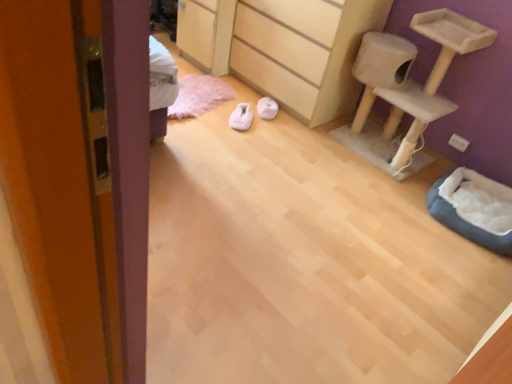
Question: Is white fabric slipper at center, which is the first footwear from right to left, far from white fabric slipper at center, arranged as the first footwear when viewed from the left?

Choices:
 (A) no
 (B) yes

Answer: (A)

Question: Does white fabric slipper at center, which is the second footwear from left to right, have a greater height compared to white fabric slipper at center, arranged as the first footwear when viewed from the left?

Choices:
 (A) no
 (B) yes

Answer: (A)

Question: Does white fabric slipper at center, which is the first footwear from right to left, have a smaller size compared to white fabric slipper at center, the second footwear positioned from the right?

Choices:
 (A) no
 (B) yes

Answer: (B)

Question: Considering the relative sizes of white fabric slipper at center, which is the first footwear from right to left, and white fabric slipper at center, the second footwear positioned from the right, in the image provided, is white fabric slipper at center, which is the first footwear from right to left, thinner than white fabric slipper at center, the second footwear positioned from the right,?

Choices:
 (A) no
 (B) yes

Answer: (A)

Question: Is white fabric slipper at center, which is the first footwear from right to left, shorter than white fabric slipper at center, arranged as the first footwear when viewed from the left?

Choices:
 (A) yes
 (B) no

Answer: (B)

Question: Would you say white fabric slipper at center, the second footwear positioned from the right, is to the left or to the right of beige carpeted cat tree at upper right in the picture?

Choices:
 (A) right
 (B) left

Answer: (B)

Question: In terms of height, does white fabric slipper at center, the second footwear positioned from the right, look taller or shorter compared to beige carpeted cat tree at upper right?

Choices:
 (A) tall
 (B) short

Answer: (B)

Question: Is point (249, 112) closer or farther from the camera than point (360, 44)?

Choices:
 (A) closer
 (B) farther

Answer: (B)

Question: In the image, is white fabric slipper at center, arranged as the first footwear when viewed from the left, positioned in front of or behind beige carpeted cat tree at upper right?

Choices:
 (A) front
 (B) behind

Answer: (B)

Question: Considering their positions, is white fabric slipper at center, which is the first footwear from right to left, located in front of or behind white fabric slipper at center, arranged as the first footwear when viewed from the left?

Choices:
 (A) front
 (B) behind

Answer: (B)

Question: From a real-world perspective, relative to white fabric slipper at center, arranged as the first footwear when viewed from the left, is white fabric slipper at center, which is the first footwear from right to left, vertically above or below?

Choices:
 (A) above
 (B) below

Answer: (B)

Question: Would you say white fabric slipper at center, which is the first footwear from right to left, is to the left or to the right of white fabric slipper at center, arranged as the first footwear when viewed from the left, in the picture?

Choices:
 (A) left
 (B) right

Answer: (B)

Question: From the image's perspective, is white fabric slipper at center, which is the first footwear from right to left, located above or below white fabric slipper at center, the second footwear positioned from the right?

Choices:
 (A) above
 (B) below

Answer: (A)

Question: Is dark gray plush cat bed at lower right to the left or to the right of light wood/texture chest of drawers at center in the image?

Choices:
 (A) right
 (B) left

Answer: (A)

Question: Is dark gray plush cat bed at lower right inside the boundaries of light wood/texture chest of drawers at center, or outside?

Choices:
 (A) inside
 (B) outside

Answer: (B)